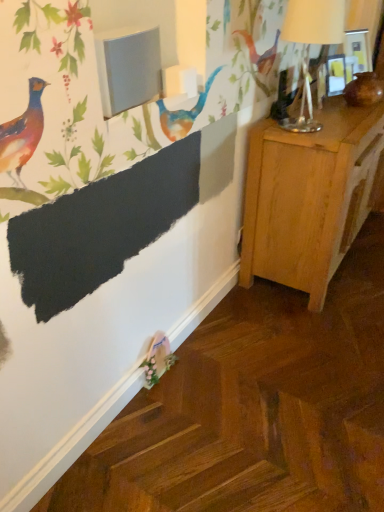
In order to click on vacant area situated below metallic silver table lamp at upper right (from a real-world perspective) in this screenshot , I will do `click(303, 125)`.